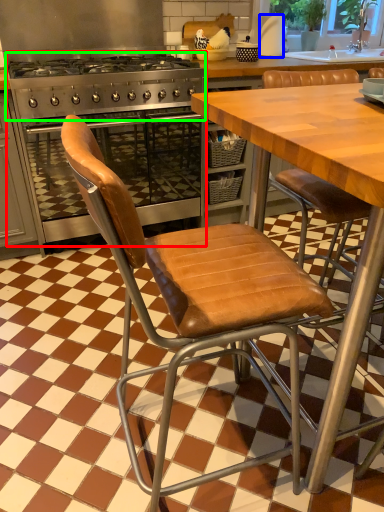
Question: Based on their relative distances, which object is nearer to kitchen appliance (highlighted by a red box)? Choose from paper towel (highlighted by a blue box) and gas stove (highlighted by a green box).

Choices:
 (A) paper towel
 (B) gas stove

Answer: (B)